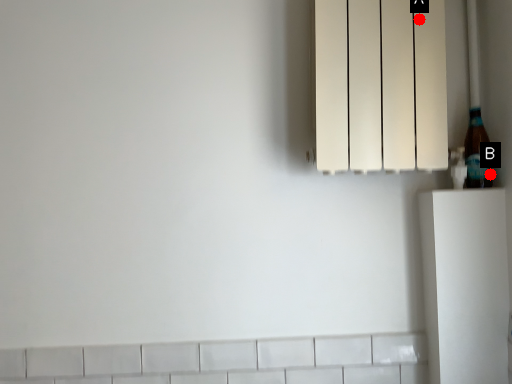
Question: Two points are circled on the image, labeled by A and B beside each circle. Which of the following is the closest to the observer?

Choices:
 (A) A is closer
 (B) B is closer

Answer: (A)